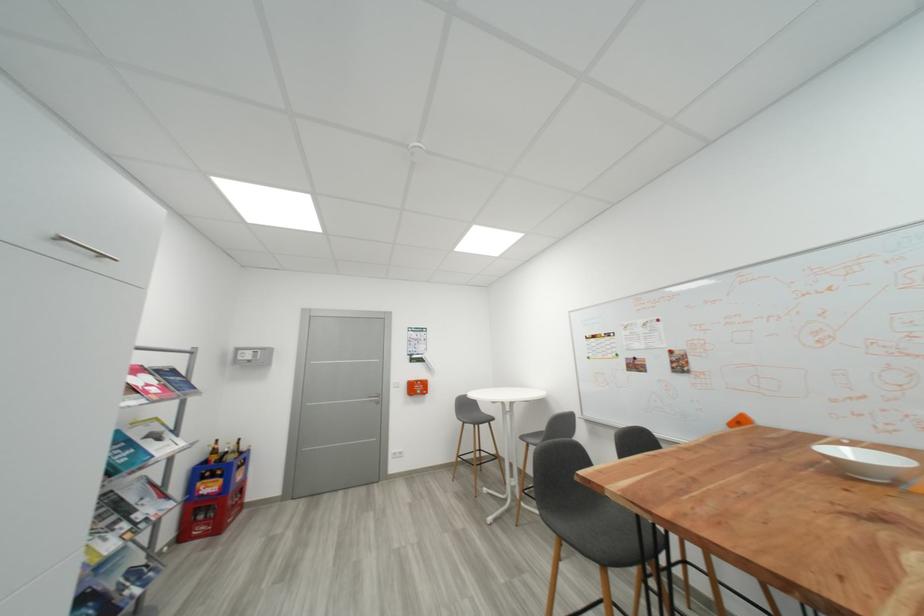
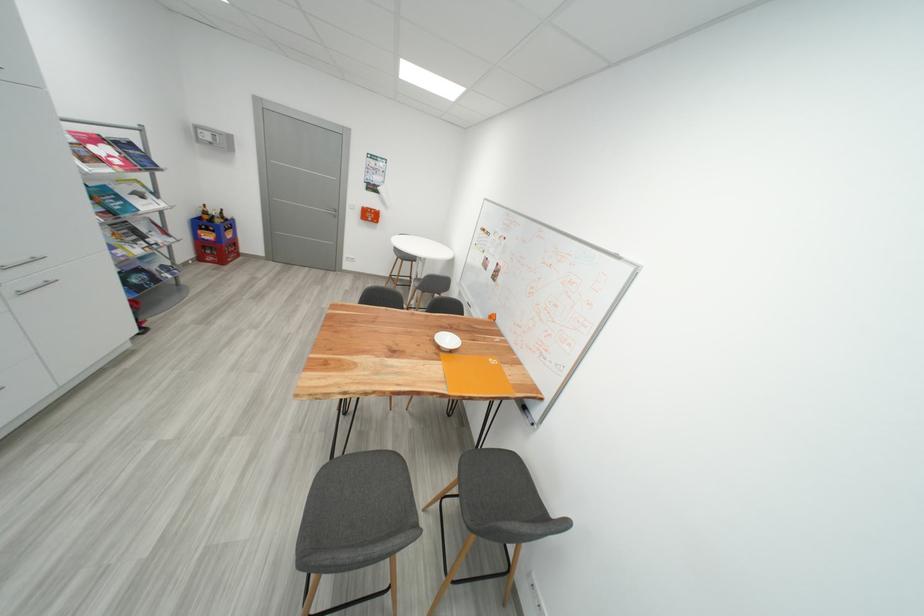
In the second image, find the point that corresponds to (x=139, y=392) in the first image.

(104, 161)